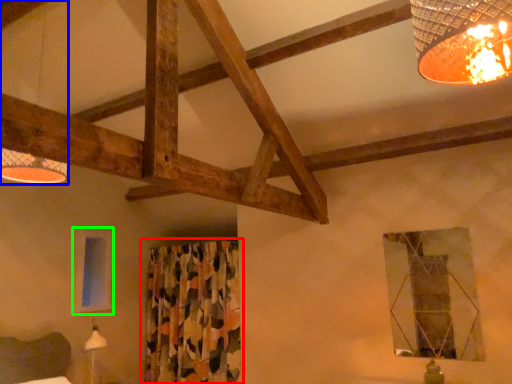
Question: Which object is positioned farthest from curtain (highlighted by a red box)? Select from lamp (highlighted by a blue box) and window (highlighted by a green box).

Choices:
 (A) lamp
 (B) window

Answer: (A)